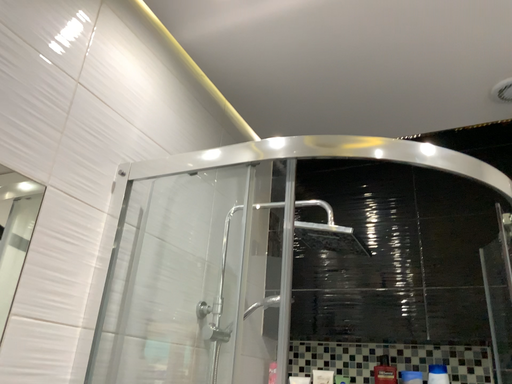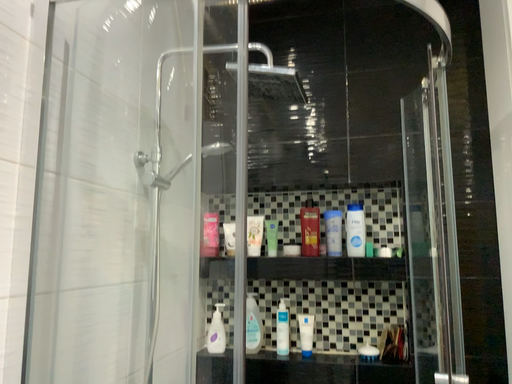
Question: How did the camera likely rotate when shooting the video?

Choices:
 (A) rotated downward
 (B) rotated upward

Answer: (A)